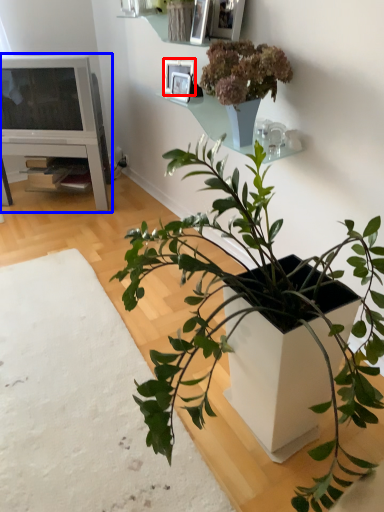
Question: Which point is further to the camera, picture frame (highlighted by a red box) or entertainment center (highlighted by a blue box)?

Choices:
 (A) picture frame
 (B) entertainment center

Answer: (B)